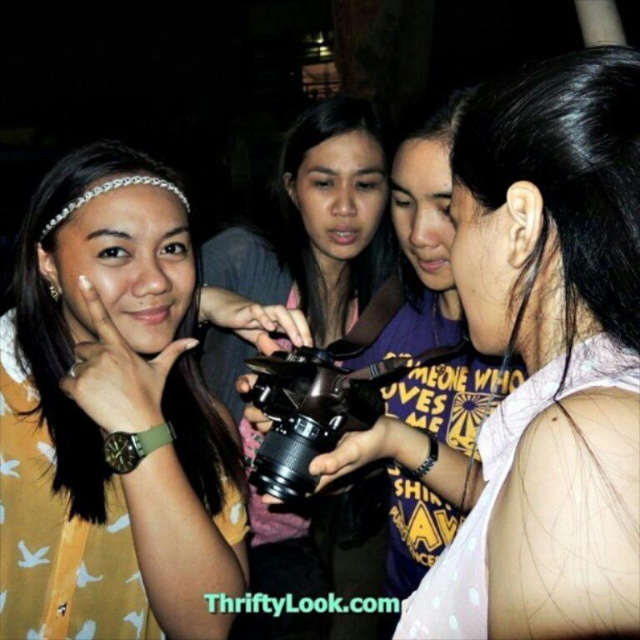
You are a photographer trying to decide which camera to use for a quick photo. The black matte camera at center and the black plastic camera at center are both in your view. Which one is positioned lower and easier to reach without bending?

The black matte camera at center is below the black plastic camera at center, so it is positioned lower and easier to reach without bending.

Based on the coordinates provided, which object is located at point (113,412)?

The point (113,412) corresponds to the yellow matte shirt at left.

You are a photographer who needs to choose between the black matte camera at center and the black plastic camera at center based on their size. Which camera is wider?

The black matte camera at center is wider than the black plastic camera at center.